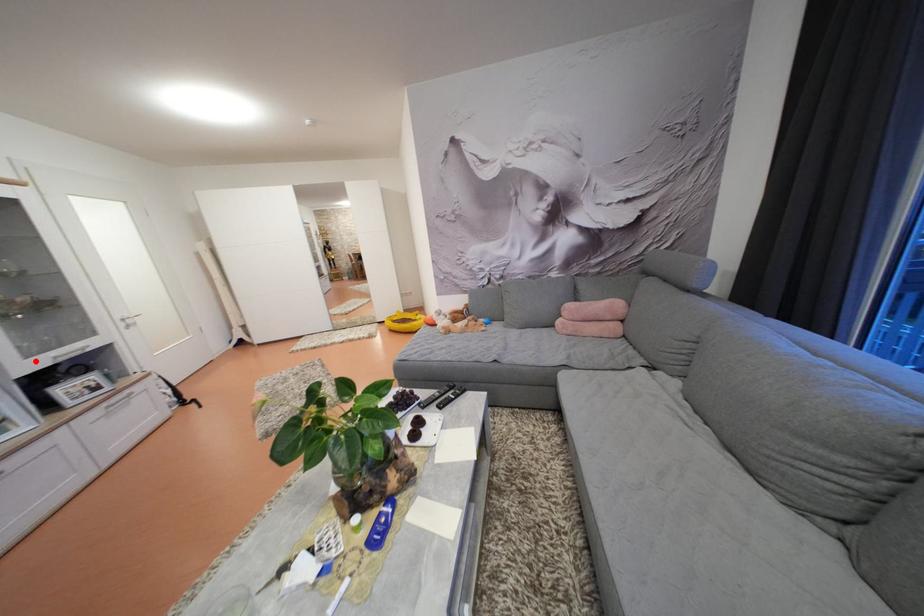
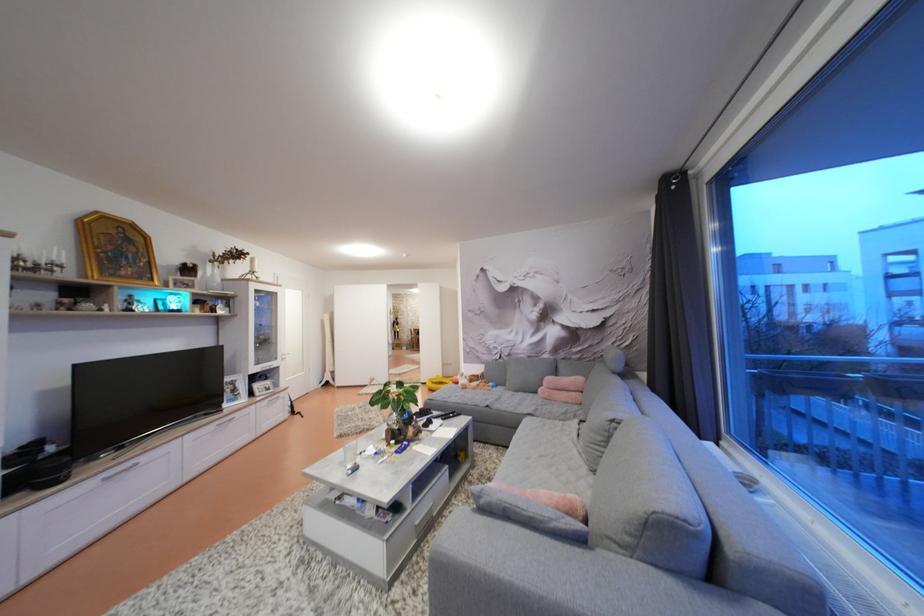
Question: A red point is marked in image1. In image2, is the corresponding 3D point closer to the camera or farther? Reply with the corresponding letter.

Choices:
 (A) The corresponding 3D point is closer.
 (B) The corresponding 3D point is farther.

Answer: (A)